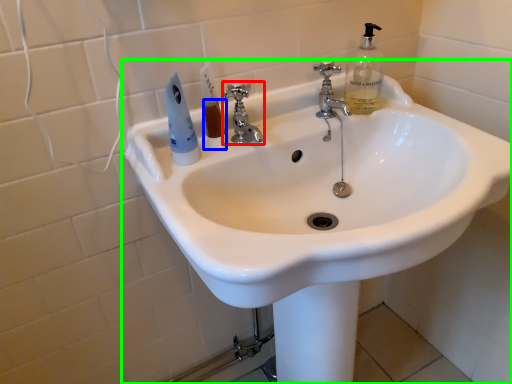
Question: Which object is positioned closest to tap (highlighted by a red box)? Select from liquid (highlighted by a blue box) and sink (highlighted by a green box).

Choices:
 (A) liquid
 (B) sink

Answer: (A)